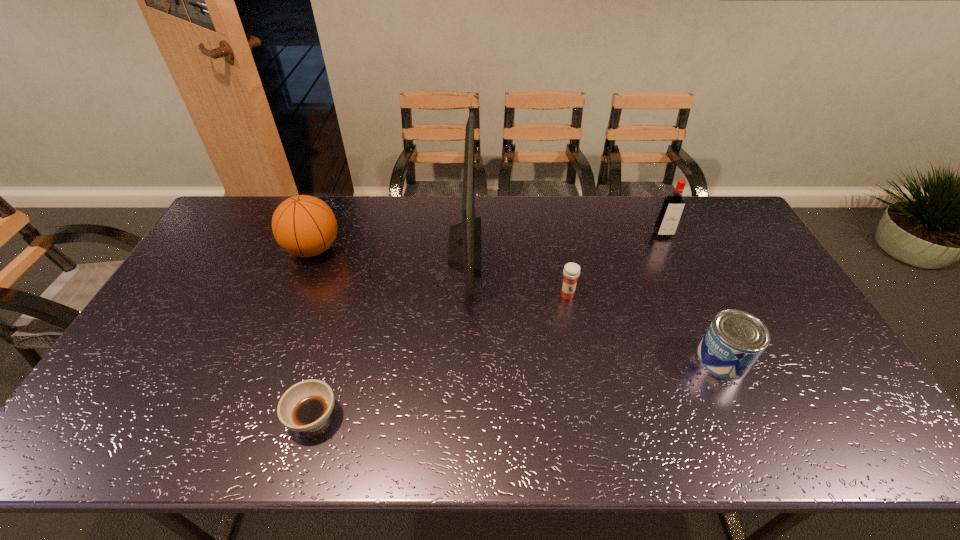
At what (x,y) coordinates should I click in order to perform the action: click on free location located 0.270m on the front of the leftmost object. Please return your answer as a coordinate pair (x, y). Image resolution: width=960 pixels, height=540 pixels. Looking at the image, I should click on (277, 338).

Image resolution: width=960 pixels, height=540 pixels. What are the coordinates of `blank space located 0.290m on the front label of the second nearest object` in the screenshot? It's located at (588, 359).

Identify the location of free space located 0.300m on the front label of the second nearest object. (585, 359).

Locate an element on the screen. free space located 0.110m on the front label of the second nearest object is located at coordinates (657, 359).

The width and height of the screenshot is (960, 540). Identify the location of free spot located 0.240m on the label side of the medicine. (581, 370).

Find the location of a particular element. This screenshot has height=540, width=960. free region located on the back of the shortest object is located at coordinates (350, 290).

I want to click on monitor that is at the far edge, so (464, 250).

Find the location of `vodka present at the far edge`. vodka present at the far edge is located at coordinates (669, 216).

I want to click on basketball located in the far edge section of the desktop, so click(305, 226).

At what (x,y) coordinates should I click in order to perform the action: click on object at the near edge. Please return your answer as a coordinate pair (x, y). The height and width of the screenshot is (540, 960). Looking at the image, I should click on (306, 406).